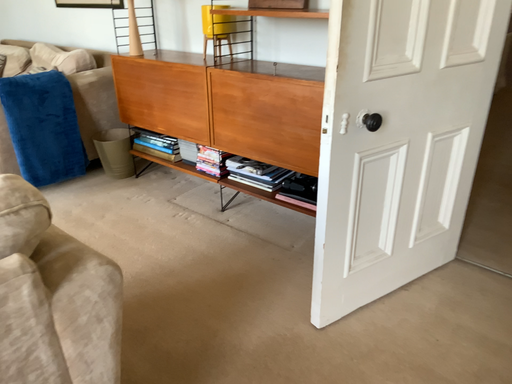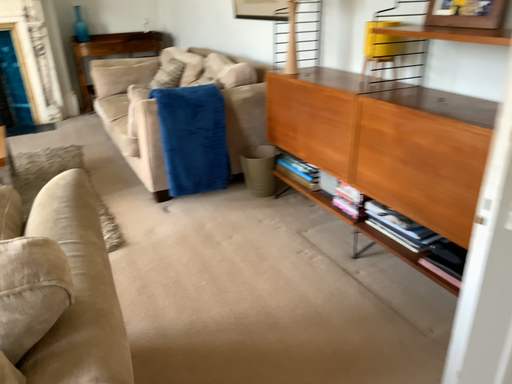
Question: Which way did the camera rotate in the video?

Choices:
 (A) rotated right
 (B) rotated left

Answer: (B)